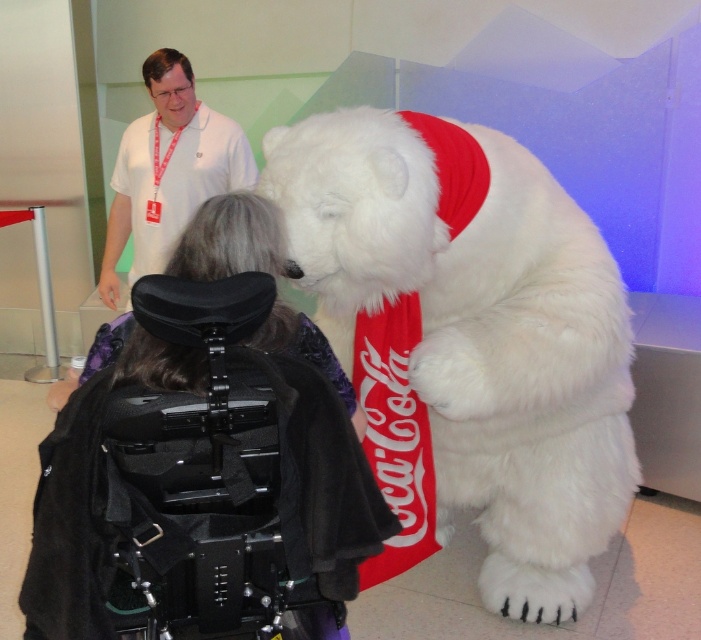
You are organizing an event and need to ensure accessibility for attendees in wheelchairs. The white fluffy bear at center and dark purple fabric at center are part of the setup. Which object is closer to the wheelchair user seated at center?

The white fluffy bear at center is closer to the wheelchair user seated at center because the dark purple fabric at center is behind it, meaning the bear is in front.

You are organizing an event and need to ensure accessibility for all attendees. There is a white fluffy bear at center and a white cotton shirt at upper left in the image. Which object is positioned lower in the scene?

The white fluffy bear at center is located below the white cotton shirt at upper left, so the bear is positioned lower in the scene.

You are standing at the origin point in the image. The white fluffy bear at center is located at point (468, 340). If you want to move towards the white fluffy bear at center, in which direction should you move?

The white fluffy bear at center is located at point (468, 340), so you should move towards that coordinate to reach it.